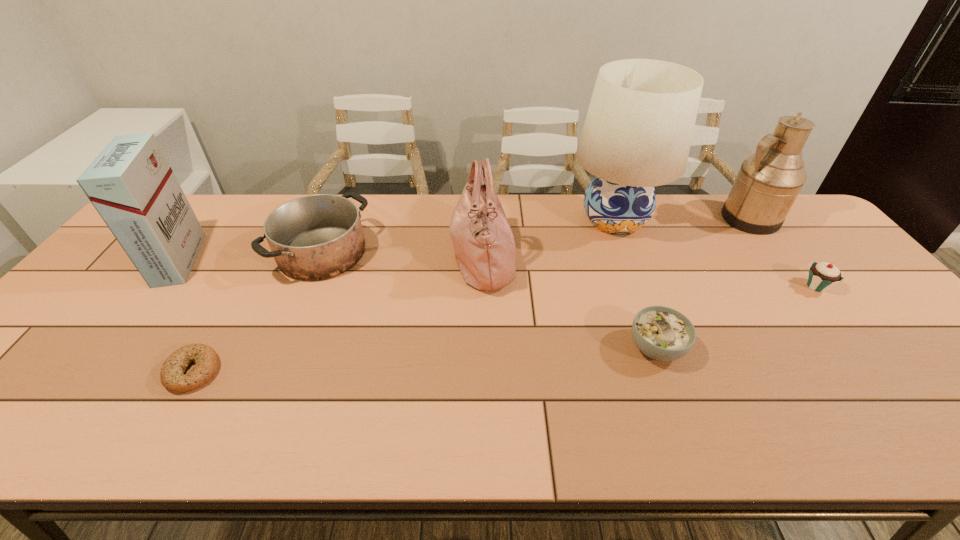
The height and width of the screenshot is (540, 960). Identify the location of cigarette case located at the far edge. (130, 183).

Find the location of a particular element. This screenshot has width=960, height=540. handbag that is at the far edge is located at coordinates (483, 242).

Identify the location of saucepan that is at the far edge. (316, 237).

You are a GUI agent. You are given a task and a screenshot of the screen. Output one action in this format:
    pyautogui.click(x=<x>, y=<y>)
    Task: Click on the object that is positioned at the left edge
    The image size is (960, 540).
    Given the screenshot: What is the action you would take?
    pyautogui.click(x=130, y=183)

Find the location of a particular element. The width and height of the screenshot is (960, 540). pitcher at the right edge is located at coordinates (768, 182).

What are the coordinates of `cupcake located in the right edge section of the desktop` in the screenshot? It's located at (822, 276).

Identify the location of object that is at the far left corner. This screenshot has height=540, width=960. (130, 183).

At what (x,y) coordinates should I click in order to perform the action: click on object positioned at the far right corner. Please return your answer as a coordinate pair (x, y). Looking at the image, I should click on (768, 182).

The width and height of the screenshot is (960, 540). In the image, there is a desktop. What are the coordinates of `free space at the far edge` in the screenshot? It's located at (247, 200).

Locate an element on the screen. This screenshot has width=960, height=540. vacant space at the near edge is located at coordinates (859, 426).